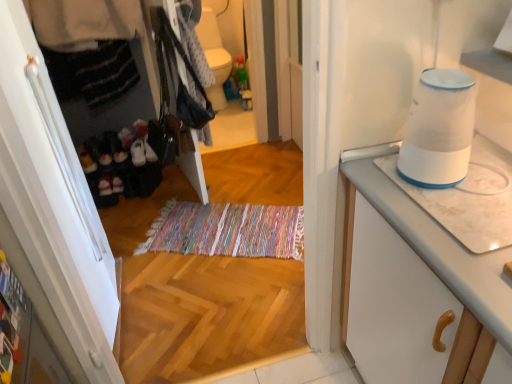
Question: From a real-world perspective, is white glossy toilet bowl at upper center over white plastic humidifier at upper right?

Choices:
 (A) yes
 (B) no

Answer: (B)

Question: Can white plastic humidifier at upper right be found inside white glossy toilet bowl at upper center?

Choices:
 (A) no
 (B) yes

Answer: (A)

Question: Is the position of white glossy toilet bowl at upper center less distant than that of white plastic humidifier at upper right?

Choices:
 (A) no
 (B) yes

Answer: (A)

Question: Is white glossy toilet bowl at upper center located outside white plastic humidifier at upper right?

Choices:
 (A) no
 (B) yes

Answer: (B)

Question: Could you tell me if white glossy toilet bowl at upper center is facing white plastic humidifier at upper right?

Choices:
 (A) yes
 (B) no

Answer: (A)

Question: From a real-world perspective, is white glossy toilet bowl at upper center located beneath white plastic humidifier at upper right?

Choices:
 (A) yes
 (B) no

Answer: (A)

Question: Considering the relative sizes of black fabric shoes at left and white marble countertop at right in the image provided, is black fabric shoes at left shorter than white marble countertop at right?

Choices:
 (A) no
 (B) yes

Answer: (B)

Question: From the image's perspective, is black fabric shoes at left on top of white marble countertop at right?

Choices:
 (A) no
 (B) yes

Answer: (B)

Question: Can you confirm if black fabric shoes at left is bigger than white marble countertop at right?

Choices:
 (A) yes
 (B) no

Answer: (B)

Question: Is black fabric shoes at left thinner than white marble countertop at right?

Choices:
 (A) yes
 (B) no

Answer: (A)

Question: Is black fabric shoes at left looking in the opposite direction of white marble countertop at right?

Choices:
 (A) no
 (B) yes

Answer: (A)

Question: Is black fabric shoes at left at the left side of white marble countertop at right?

Choices:
 (A) yes
 (B) no

Answer: (A)

Question: From the image's perspective, is white marble countertop at right over white glossy toilet bowl at upper center?

Choices:
 (A) yes
 (B) no

Answer: (B)